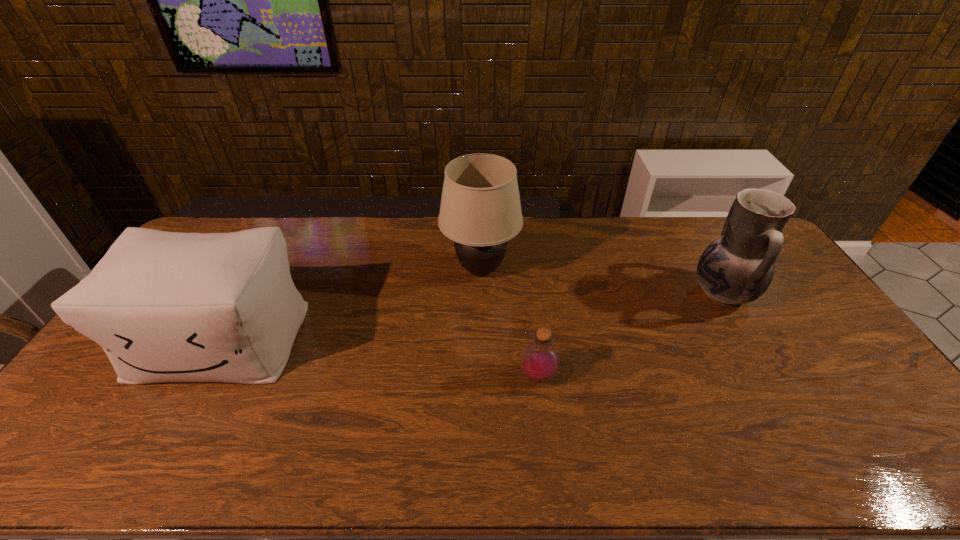
Where is `object situated at the far edge`? The image size is (960, 540). object situated at the far edge is located at coordinates (480, 210).

Locate an element on the screen. object that is positioned at the left edge is located at coordinates coord(166,307).

Where is `object situated at the right edge`? object situated at the right edge is located at coordinates (737, 268).

I want to click on blank space at the far edge, so click(x=348, y=218).

This screenshot has width=960, height=540. What are the coordinates of `vacant space at the near edge of the desktop` in the screenshot? It's located at (530, 457).

In order to click on vacant region at the left edge of the desktop in this screenshot , I will do click(94, 396).

The height and width of the screenshot is (540, 960). In the image, there is a desktop. Identify the location of blank space at the right edge. (841, 370).

Where is `empty location between the bottle and the pitcher`? The width and height of the screenshot is (960, 540). empty location between the bottle and the pitcher is located at coordinates (631, 334).

Find the location of `vacant region between the leftmost object and the lampshade`. vacant region between the leftmost object and the lampshade is located at coordinates (350, 305).

Identify the location of free space between the cushion and the pitcher. The height and width of the screenshot is (540, 960). click(471, 316).